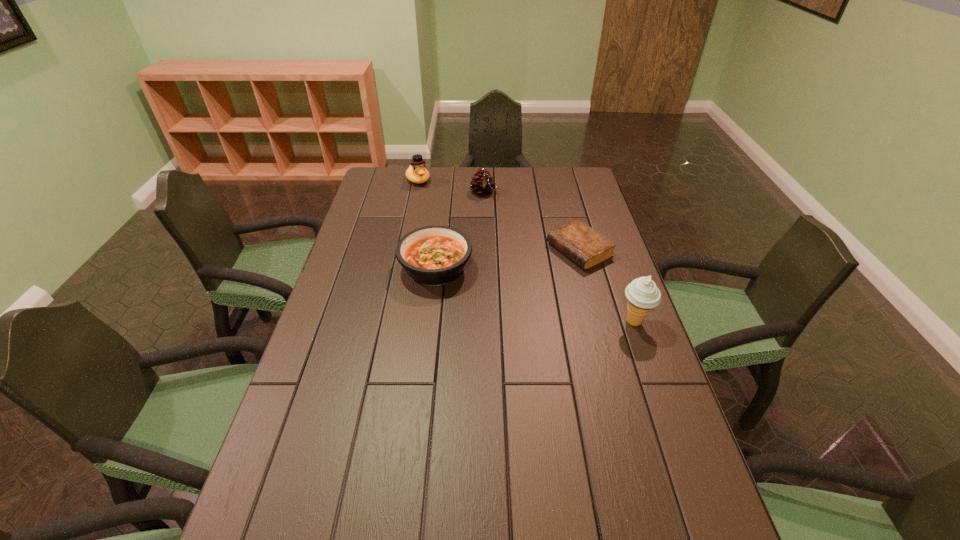
Where is `stew`? stew is located at coordinates (432, 255).

I want to click on the tallest object, so click(x=642, y=293).

The image size is (960, 540). I want to click on icecream, so click(642, 293).

At what (x,y) coordinates should I click in order to perform the action: click on pinecone. Please return your answer as a coordinate pair (x, y). The height and width of the screenshot is (540, 960). Looking at the image, I should click on (483, 184).

Find the location of a particular element. This screenshot has width=960, height=540. diary is located at coordinates (586, 247).

Locate an element on the screen. duck is located at coordinates (416, 173).

Where is `free space located on the front of the second shortest object`? Image resolution: width=960 pixels, height=540 pixels. free space located on the front of the second shortest object is located at coordinates (421, 396).

In order to click on blank space located 0.270m on the left of the tallest object in this screenshot , I will do `click(522, 321)`.

What are the coordinates of `vacant space located with a leaf charm attached to the pinecone` in the screenshot? It's located at (508, 235).

Where is `blank space located with a leaf charm attached to the pinecone`? The width and height of the screenshot is (960, 540). blank space located with a leaf charm attached to the pinecone is located at coordinates (516, 249).